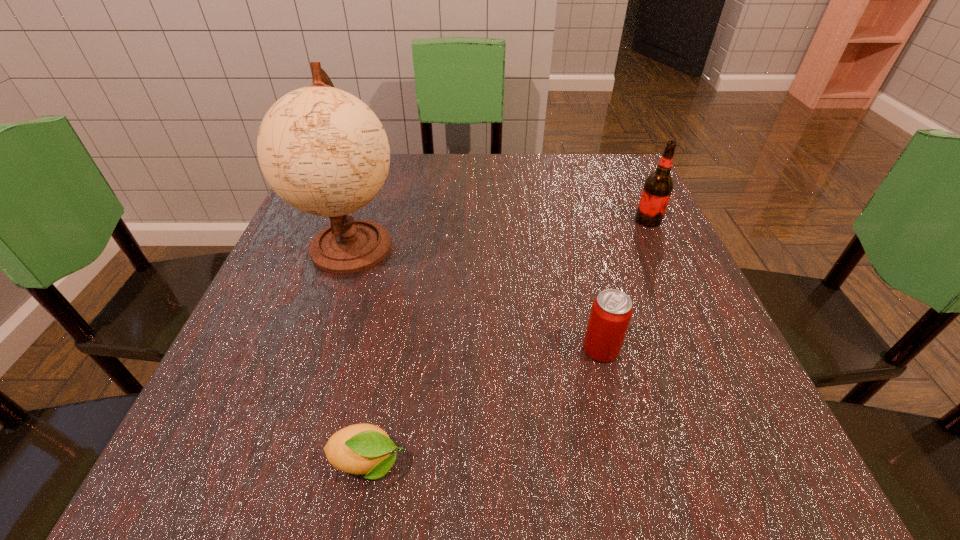
The width and height of the screenshot is (960, 540). Identify the location of vacant space located with leaves positioned above the nearest object. (468, 463).

Find the location of `object that is at the near edge`. object that is at the near edge is located at coordinates (358, 449).

Image resolution: width=960 pixels, height=540 pixels. Find the location of `object present at the left edge`. object present at the left edge is located at coordinates (322, 150).

At what (x,y) coordinates should I click in order to perform the action: click on object positioned at the right edge. Please return your answer as a coordinate pair (x, y). The height and width of the screenshot is (540, 960). Looking at the image, I should click on (658, 186).

In order to click on vacant space at the far edge of the desktop in this screenshot , I will do `click(424, 198)`.

The height and width of the screenshot is (540, 960). In order to click on vacant position at the near edge of the desktop in this screenshot , I will do point(430,433).

This screenshot has width=960, height=540. What are the coordinates of `vacant space at the left edge of the desktop` in the screenshot? It's located at click(285, 347).

Find the location of a particular element. The width and height of the screenshot is (960, 540). vacant space at the right edge of the desktop is located at coordinates (656, 374).

In order to click on vacant space at the near left corner of the desktop in this screenshot , I will do `click(286, 465)`.

In the image, there is a desktop. Find the location of `vacant space at the far right corner`. vacant space at the far right corner is located at coordinates (590, 186).